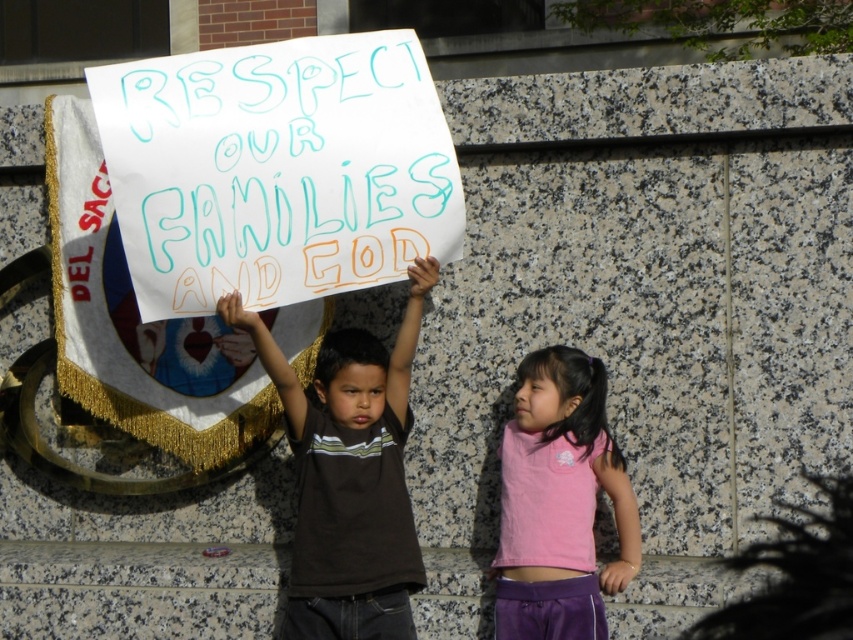
Looking at this image, can you confirm if white paper sign at center is positioned to the left of dark brown t-shirt at center?

Indeed, white paper sign at center is positioned on the left side of dark brown t-shirt at center.

Who is lower down, white paper sign at center or dark brown t-shirt at center?

Positioned lower is dark brown t-shirt at center.

Describe the element at coordinates (276, 170) in the screenshot. The width and height of the screenshot is (853, 640). I see `white paper sign at center` at that location.

Where is `white paper sign at center`? white paper sign at center is located at coordinates (276, 170).

Does white paper sign at center have a lesser height compared to pink fabric shirt at center?

In fact, white paper sign at center may be taller than pink fabric shirt at center.

Is white paper sign at center further to camera compared to pink fabric shirt at center?

No, it is in front of pink fabric shirt at center.

Where is `white paper sign at center`? The image size is (853, 640). white paper sign at center is located at coordinates (276, 170).

You are a GUI agent. You are given a task and a screenshot of the screen. Output one action in this format:
    pyautogui.click(x=<x>, y=<y>)
    Task: Click on the white paper sign at center
    The width and height of the screenshot is (853, 640).
    Given the screenshot: What is the action you would take?
    pyautogui.click(x=276, y=170)

Who is shorter, dark brown t-shirt at center or pink fabric shirt at center?

pink fabric shirt at center

Between point (376, 452) and point (532, 625), which one is positioned in front?

Point (532, 625) is more forward.

At what (x,y) coordinates should I click in order to perform the action: click on dark brown t-shirt at center. Please return your answer as a coordinate pair (x, y). The width and height of the screenshot is (853, 640). Looking at the image, I should click on coord(349,476).